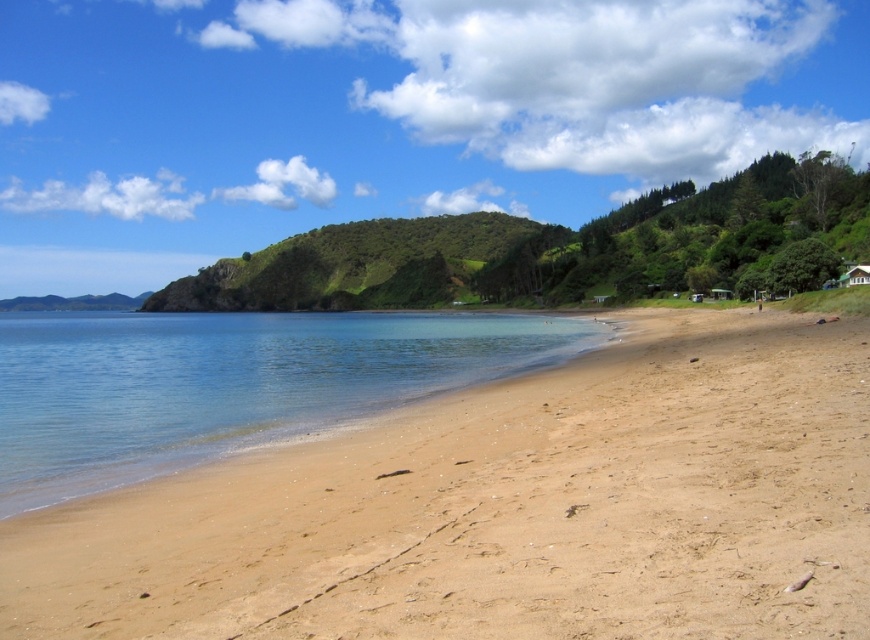
You are standing on the beach looking at the scene. There are two points marked on the image, point 1 at coordinates point (594, 628) and point 2 at coordinates point (239, 381). Which point is closer to you?

Point (594, 628) is closer to the camera than point (239, 381), so the point closer to you is point (594, 628).

In the scene shown: You are standing on the sandy beach at lower right and want to reach the clear blue water at center. Which direction should you move to get there?

Since the sandy beach at lower right is positioned on the right side of clear blue water at center, you should move to the left to reach the clear blue water at center.